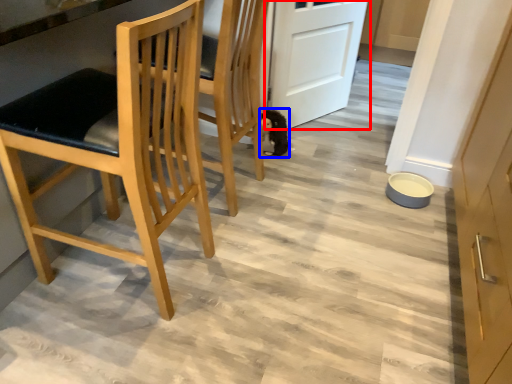
Question: Which of the following is the farthest to the observer, door (highlighted by a red box) or animal (highlighted by a blue box)?

Choices:
 (A) door
 (B) animal

Answer: (B)